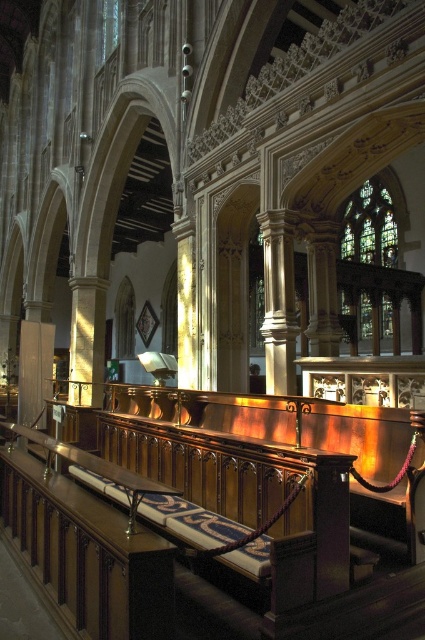
Question: Estimate the real-world distances between objects in this image. Which object is farther from the polished wood church bench at center?

Choices:
 (A) polished stone column at center
 (B) stained glass window at upper right

Answer: (B)

Question: Does polished wood church bench at center have a lesser width compared to polished stone column at center?

Choices:
 (A) yes
 (B) no

Answer: (B)

Question: Which point is closer to the camera?

Choices:
 (A) polished stone column at center
 (B) polished wood church bench at center

Answer: (B)

Question: Is polished wood church bench at center positioned at the back of stained glass window at upper right?

Choices:
 (A) yes
 (B) no

Answer: (B)

Question: Does polished wood church bench at center have a greater width compared to stained glass window at upper right?

Choices:
 (A) no
 (B) yes

Answer: (B)

Question: Which of the following is the farthest from the observer?

Choices:
 (A) (286, 337)
 (B) (308, 500)

Answer: (A)